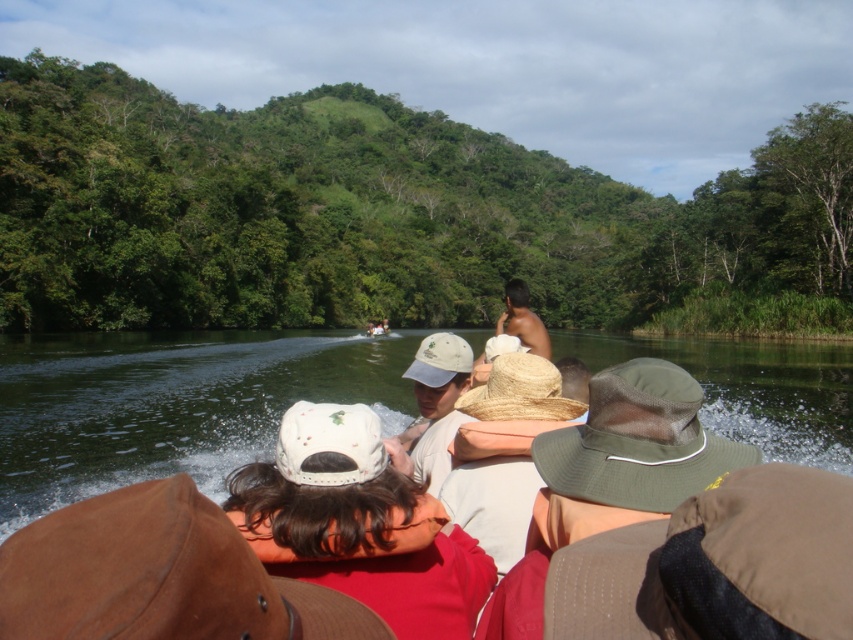
You are standing on the riverbank and want to take a photo of the green leafy hillside at upper center and the white matte baseball cap at center. Which object should you focus on first to ensure both are in focus?

You should focus on the white matte baseball cap at center first because it is closer to you than the green leafy hillside at upper center, which is further away. This way, both objects can be in focus as the closer object will set the focal plane.

You are a photographer trying to capture a wide shot of the scene. You notice the green leafy hillside at upper center and the white matte baseball cap at center. Which object should you focus on to ensure both are in frame without cropping? Explain your reasoning.

The green leafy hillside at upper center is wider than the white matte baseball cap at center. Therefore, focusing on the wider object, the green leafy hillside at upper center, will ensure both are captured without cropping since it occupies more space in the frame.